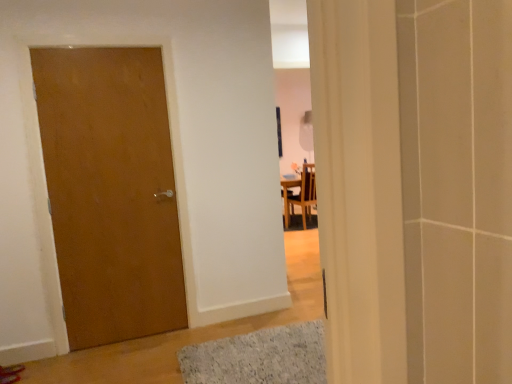
Question: Can you confirm if wooden chair at center is shorter than matte wood door at left?

Choices:
 (A) yes
 (B) no

Answer: (A)

Question: Is wooden chair at center with matte wood door at left?

Choices:
 (A) yes
 (B) no

Answer: (B)

Question: Considering the relative sizes of wooden chair at center and matte wood door at left in the image provided, is wooden chair at center thinner than matte wood door at left?

Choices:
 (A) no
 (B) yes

Answer: (A)

Question: Is wooden chair at center not inside matte wood door at left?

Choices:
 (A) no
 (B) yes

Answer: (B)

Question: Considering the relative positions of wooden chair at center and matte wood door at left in the image provided, is wooden chair at center to the left of matte wood door at left from the viewer's perspective?

Choices:
 (A) yes
 (B) no

Answer: (B)

Question: From a real-world perspective, is wooden chair at center beneath matte wood door at left?

Choices:
 (A) no
 (B) yes

Answer: (B)

Question: Can you confirm if wooden chair at center is positioned to the right of gray textured bath mat at lower center?

Choices:
 (A) yes
 (B) no

Answer: (A)

Question: Can you confirm if wooden chair at center is bigger than gray textured bath mat at lower center?

Choices:
 (A) no
 (B) yes

Answer: (B)

Question: Is wooden chair at center not inside gray textured bath mat at lower center?

Choices:
 (A) no
 (B) yes

Answer: (B)

Question: Is wooden chair at center wider than gray textured bath mat at lower center?

Choices:
 (A) yes
 (B) no

Answer: (B)

Question: Does wooden chair at center have a smaller size compared to gray textured bath mat at lower center?

Choices:
 (A) yes
 (B) no

Answer: (B)

Question: Can gray textured bath mat at lower center be found inside wooden chair at center?

Choices:
 (A) no
 (B) yes

Answer: (A)

Question: Is matte wood door at left inside gray textured bath mat at lower center?

Choices:
 (A) yes
 (B) no

Answer: (B)